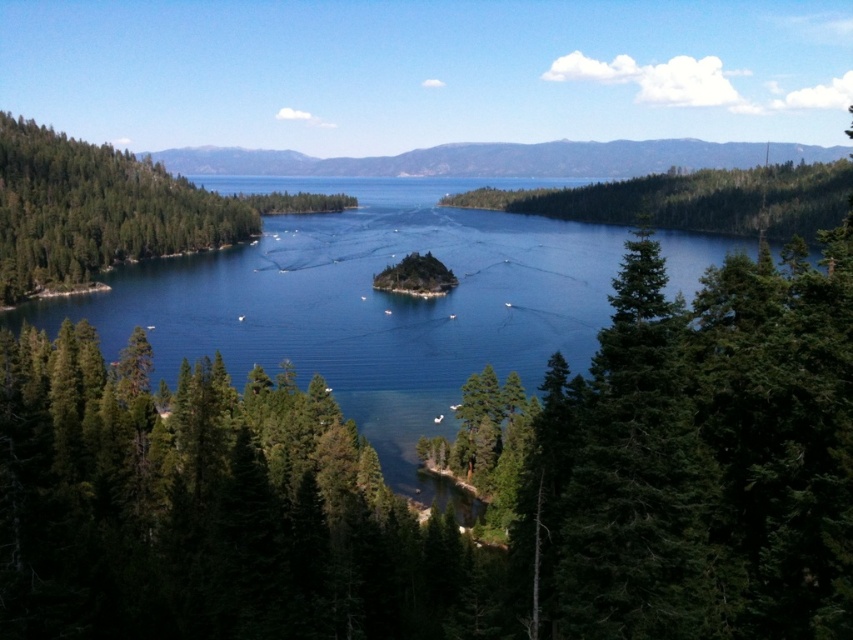
Question: Which point is closer to the camera?

Choices:
 (A) green matte tree at left
 (B) blue water at center

Answer: (B)

Question: Which point is farther from the camera taking this photo?

Choices:
 (A) (38, 257)
 (B) (357, 195)

Answer: (B)

Question: Does blue water at center appear on the right side of green matte tree at left?

Choices:
 (A) yes
 (B) no

Answer: (A)

Question: Does blue water at center come behind green matte tree at left?

Choices:
 (A) no
 (B) yes

Answer: (A)

Question: Is blue water at center thinner than green matte tree at left?

Choices:
 (A) no
 (B) yes

Answer: (A)